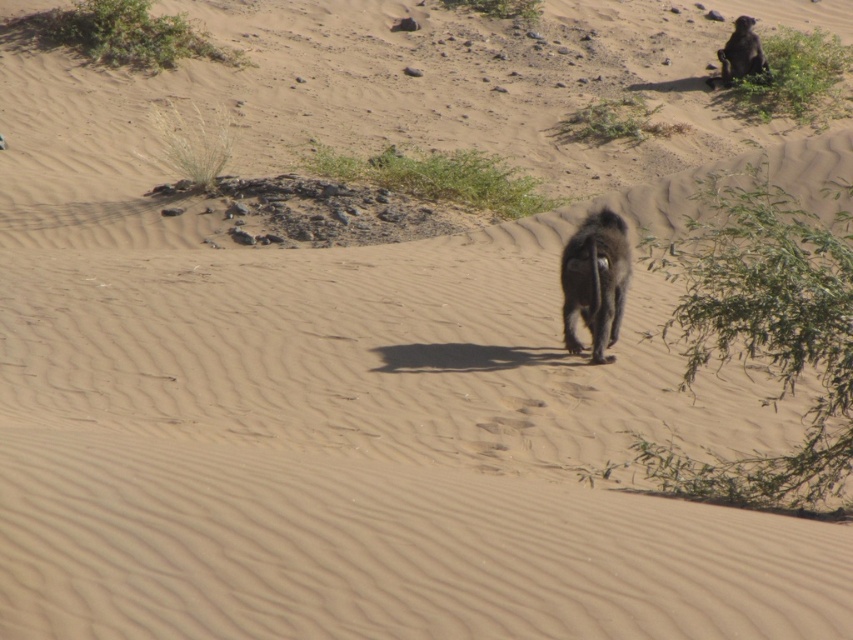
From the picture: You are observing a desert scene with two monkeys. The brown furry monkey at center and the black furry monkey at upper right. Which monkey has a more slender body?

The brown furry monkey at center is thinner than the black furry monkey at upper right, so it has a more slender body.

You are a wildlife photographer observing the desert scene. You notice a brown furry monkey at center and a black furry monkey at upper right. Which monkey would appear closer to you based on their size in the image?

The brown furry monkey at center appears closer because it is smaller in size compared to the black furry monkey at upper right, which suggests that the smaller monkey is nearer due to perspective.

You are a photographer trying to capture both the brown furry monkey at center and the black furry monkey at upper right in a single frame. Which monkey should you adjust your camera to focus on first if you want to include both in your photo?

The brown furry monkey at center is positioned on the left side of black furry monkey at upper right, so you should focus on the brown furry monkey at center first to ensure both are in frame.